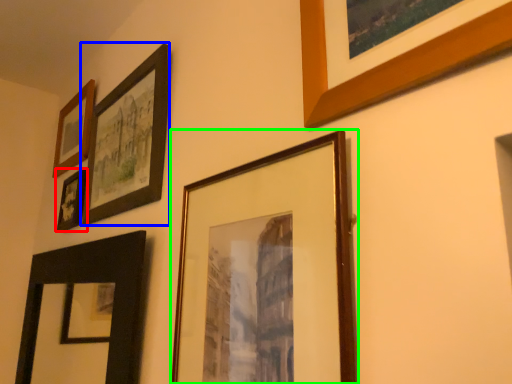
Question: Which is farther away from picture frame (highlighted by a red box)? picture frame (highlighted by a blue box) or picture frame (highlighted by a green box)?

Choices:
 (A) picture frame
 (B) picture frame

Answer: (B)